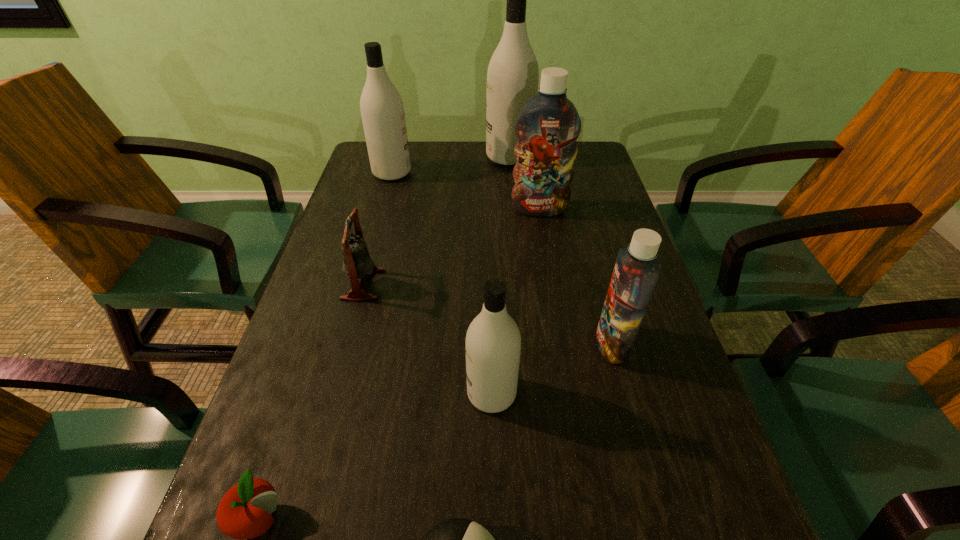
Find the location of `the biggest white shampoo`. the biggest white shampoo is located at coordinates (513, 74).

At what (x,y) coordinates should I click in order to perform the action: click on the tallest shampoo. Please return your answer as a coordinate pair (x, y). Looking at the image, I should click on (513, 74).

Identify the location of the leftmost shampoo. (382, 110).

You are a GUI agent. You are given a task and a screenshot of the screen. Output one action in this format:
    pyautogui.click(x=<x>, y=<y>)
    Task: Click on the leftmost white shampoo
    
    Given the screenshot: What is the action you would take?
    pyautogui.click(x=382, y=110)

Locate an element on the screen. This screenshot has height=540, width=960. the sixth nearest object is located at coordinates (548, 126).

Image resolution: width=960 pixels, height=540 pixels. In order to click on the farther blue shampoo in this screenshot , I will do `click(548, 126)`.

This screenshot has height=540, width=960. Identify the location of the fourth nearest object. pyautogui.click(x=637, y=268).

Image resolution: width=960 pixels, height=540 pixels. I want to click on the nearer blue shampoo, so click(x=637, y=268).

This screenshot has height=540, width=960. Identify the location of the nearest white shampoo. (493, 342).

The height and width of the screenshot is (540, 960). I want to click on the third nearest object, so click(493, 342).